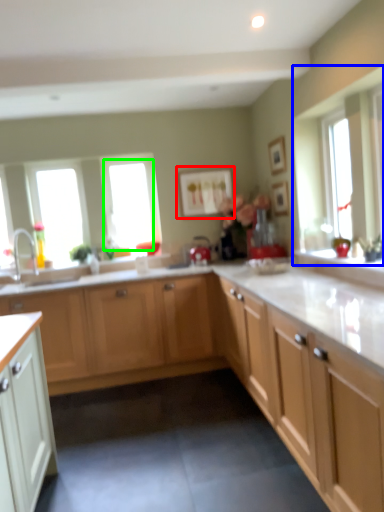
Question: Which object is positioned farthest from picture frame (highlighted by a red box)? Select from window (highlighted by a blue box) and window (highlighted by a green box).

Choices:
 (A) window
 (B) window

Answer: (A)